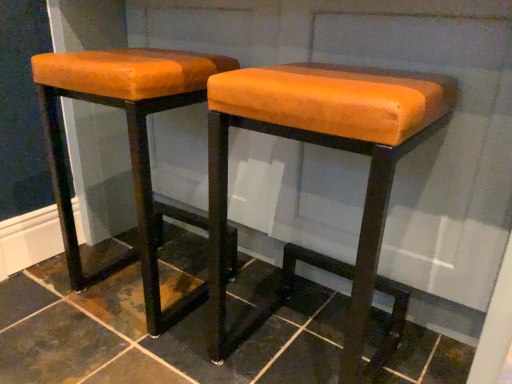
Question: Should I look upward or downward to see orange leather stool at left, placed as the second stool when sorted from right to left?

Choices:
 (A) down
 (B) up

Answer: (B)

Question: Is dark brown tile at center wider than orange leather stool at center, the first stool in the right-to-left sequence?

Choices:
 (A) yes
 (B) no

Answer: (A)

Question: Does dark brown tile at center come in front of orange leather stool at center, positioned as the 2th stool in left-to-right order?

Choices:
 (A) yes
 (B) no

Answer: (A)

Question: Is dark brown tile at center far away from orange leather stool at center, positioned as the 2th stool in left-to-right order?

Choices:
 (A) no
 (B) yes

Answer: (A)

Question: Is dark brown tile at center beside orange leather stool at center, the first stool in the right-to-left sequence?

Choices:
 (A) no
 (B) yes

Answer: (A)

Question: From a real-world perspective, is dark brown tile at center on top of orange leather stool at center, positioned as the 2th stool in left-to-right order?

Choices:
 (A) yes
 (B) no

Answer: (B)

Question: Is dark brown tile at center behind orange leather stool at center, positioned as the 2th stool in left-to-right order?

Choices:
 (A) yes
 (B) no

Answer: (B)

Question: From a real-world perspective, does orange leather stool at center, the first stool in the right-to-left sequence, sit lower than orange leather stool at left, which is counted as the first stool, starting from the left?

Choices:
 (A) yes
 (B) no

Answer: (B)

Question: Can you confirm if orange leather stool at center, the first stool in the right-to-left sequence, is wider than orange leather stool at left, which is counted as the first stool, starting from the left?

Choices:
 (A) yes
 (B) no

Answer: (A)

Question: Can you confirm if orange leather stool at center, the first stool in the right-to-left sequence, is taller than orange leather stool at left, which is counted as the first stool, starting from the left?

Choices:
 (A) yes
 (B) no

Answer: (B)

Question: Would you say orange leather stool at center, the first stool in the right-to-left sequence, contains orange leather stool at left, placed as the second stool when sorted from right to left?

Choices:
 (A) yes
 (B) no

Answer: (B)

Question: Is orange leather stool at center, the first stool in the right-to-left sequence, at the right side of orange leather stool at left, placed as the second stool when sorted from right to left?

Choices:
 (A) no
 (B) yes

Answer: (B)

Question: Is orange leather stool at center, the first stool in the right-to-left sequence, outside orange leather stool at left, placed as the second stool when sorted from right to left?

Choices:
 (A) no
 (B) yes

Answer: (B)

Question: Is orange leather stool at center, positioned as the 2th stool in left-to-right order, not close to dark brown tile at center?

Choices:
 (A) yes
 (B) no

Answer: (B)